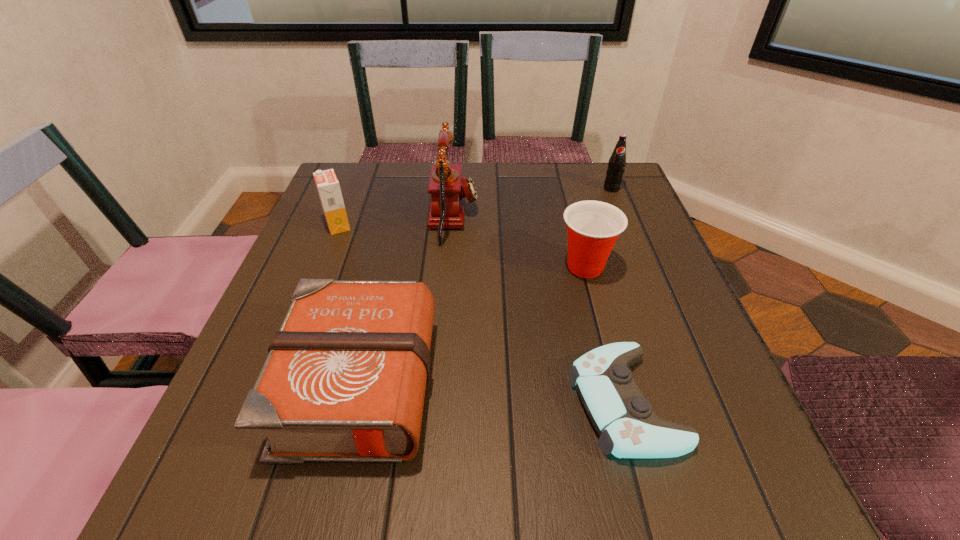
In order to click on free space between the orange juice and the pop in this screenshot , I will do `click(475, 207)`.

Locate an element on the screen. Image resolution: width=960 pixels, height=540 pixels. object that stands as the fourth closest to the orange juice is located at coordinates (628, 428).

Locate which object ranks third in proximity to the orange juice. Please provide its 2D coordinates. Your answer should be formatted as a tuple, i.e. [(x, y)], where the tuple contains the x and y coordinates of a point satisfying the conditions above.

[(593, 227)]

Where is `vacant position in the image that satisfies the following two spatial constraints: 1. on the back side of the control; 2. on the dial of the tallest object`? Image resolution: width=960 pixels, height=540 pixels. vacant position in the image that satisfies the following two spatial constraints: 1. on the back side of the control; 2. on the dial of the tallest object is located at coordinates (575, 218).

Locate an element on the screen. The width and height of the screenshot is (960, 540). vacant region that satisfies the following two spatial constraints: 1. on the dial of the telephone; 2. on the back side of the control is located at coordinates coord(440,402).

Locate an element on the screen. free region that satisfies the following two spatial constraints: 1. on the dial of the control; 2. on the left side of the tallest object is located at coordinates (440, 402).

Locate an element on the screen. This screenshot has height=540, width=960. free region that satisfies the following two spatial constraints: 1. on the back side of the shortest object; 2. on the dial of the telephone is located at coordinates (575, 218).

Where is `vacant space that satisfies the following two spatial constraints: 1. on the dial of the telephone; 2. on the back side of the control`? vacant space that satisfies the following two spatial constraints: 1. on the dial of the telephone; 2. on the back side of the control is located at coordinates (440, 402).

Identify the location of free space that satisfies the following two spatial constraints: 1. on the dial of the telephone; 2. on the right side of the fourth farthest object. (450, 266).